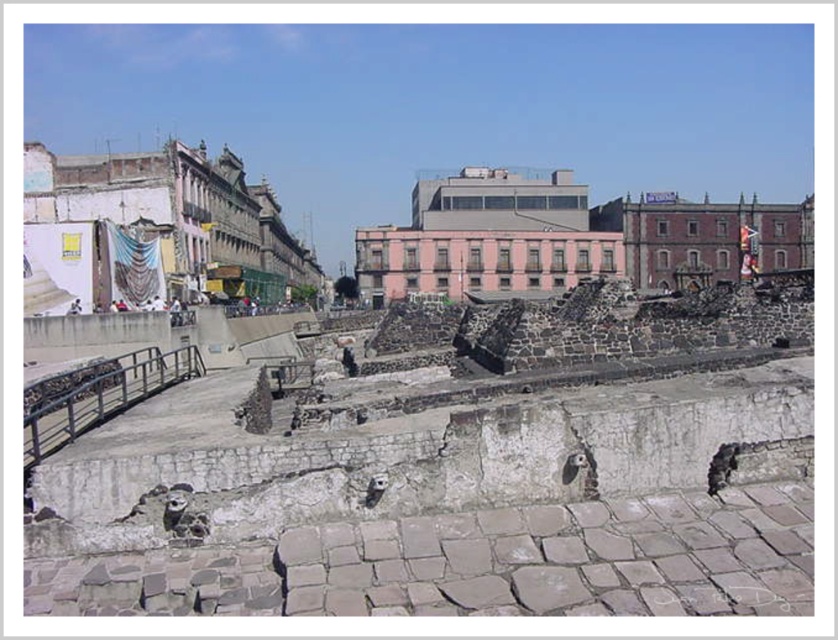
From the picture: Which is below, white fabric at upper center or light blue fabric at upper left?

light blue fabric at upper left is lower down.

Between white fabric at upper center and light blue fabric at upper left, which one has more height?

With more height is white fabric at upper center.

Is point (159, 300) closer to camera compared to point (73, 305)?

That is False.

The image size is (838, 640). In order to click on white fabric at upper center in this screenshot , I will do `click(158, 301)`.

Who is shorter, white stone ruins at left or pink concrete ruins at center?

With less height is white stone ruins at left.

Does white stone ruins at left come in front of pink concrete ruins at center?

Result: That is True.

Between point (97, 211) and point (595, 250), which one is positioned in front?

Point (97, 211) is more forward.

Find the location of a particular element. white stone ruins at left is located at coordinates (180, 216).

Locate an element on the screen. Image resolution: width=838 pixels, height=640 pixels. white stone ruins at left is located at coordinates (180, 216).

Is white stone ruins at left thinner than white fabric at upper center?

No, white stone ruins at left is not thinner than white fabric at upper center.

You are a GUI agent. You are given a task and a screenshot of the screen. Output one action in this format:
    pyautogui.click(x=<x>, y=<y>)
    Task: Click on the white stone ruins at left
    The width and height of the screenshot is (838, 640).
    Given the screenshot: What is the action you would take?
    point(180,216)